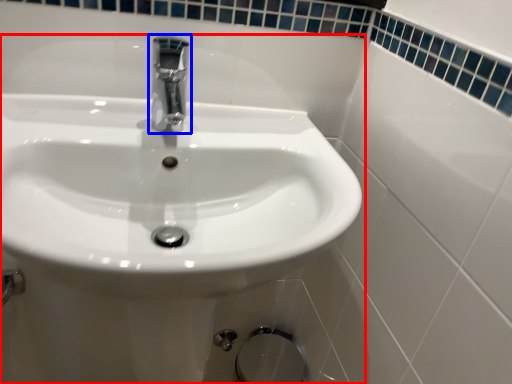
Question: Which object is closer to the camera taking this photo, sink (highlighted by a red box) or tap (highlighted by a blue box)?

Choices:
 (A) sink
 (B) tap

Answer: (A)